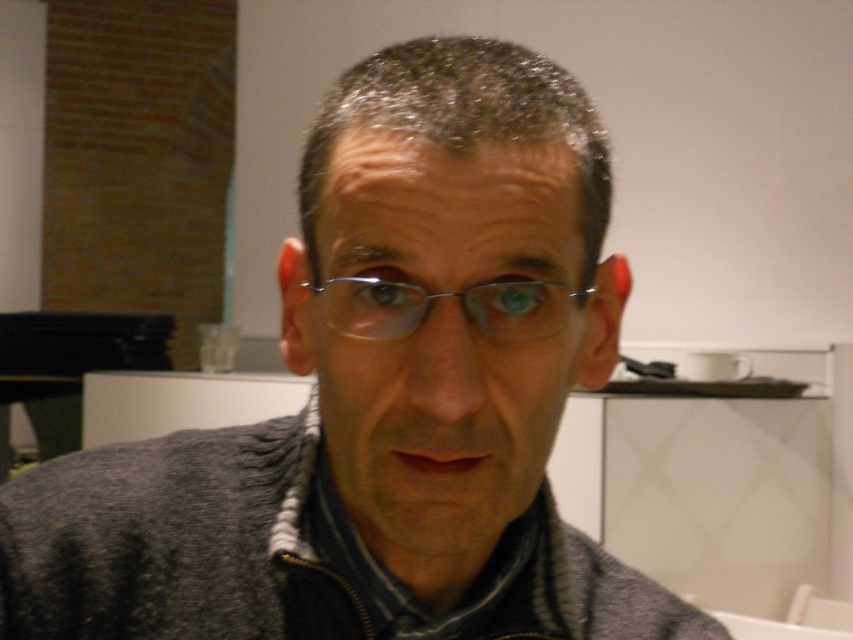
Question: Which point is closer to the camera?

Choices:
 (A) tap(544, 292)
 (B) tap(346, 483)

Answer: (A)

Question: Is matte gray sweater at center behind metallic frame glasses at center?

Choices:
 (A) no
 (B) yes

Answer: (A)

Question: Does matte gray sweater at center lie in front of metallic frame glasses at center?

Choices:
 (A) yes
 (B) no

Answer: (A)

Question: Does matte gray sweater at center have a smaller size compared to metallic frame glasses at center?

Choices:
 (A) no
 (B) yes

Answer: (A)

Question: Which point is farther from the camera taking this photo?

Choices:
 (A) (527, 193)
 (B) (337, 324)

Answer: (B)